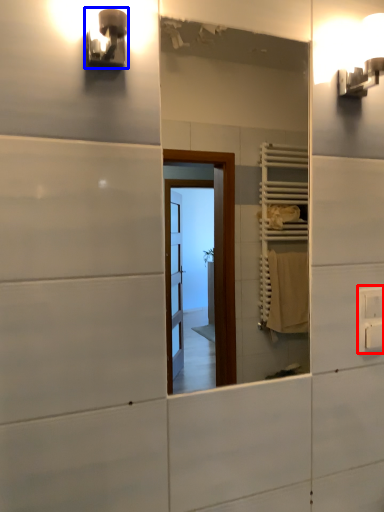
Question: Which object is further to the camera taking this photo, electric outlet (highlighted by a red box) or light fixture (highlighted by a blue box)?

Choices:
 (A) electric outlet
 (B) light fixture

Answer: (A)